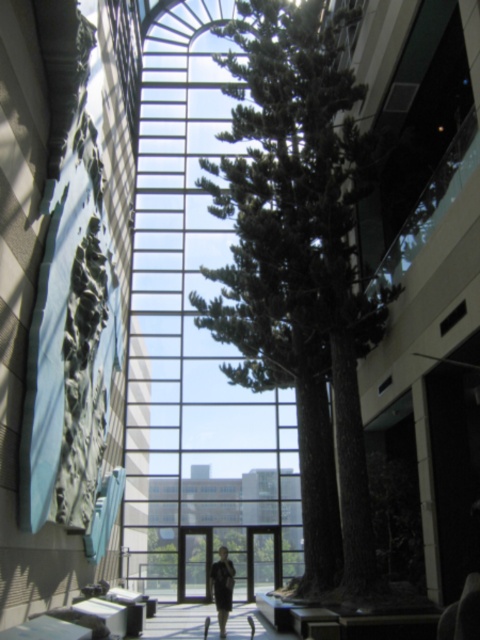
Question: Is green textured tree at center thinner than dark gray suit at center?

Choices:
 (A) yes
 (B) no

Answer: (B)

Question: Where is green textured tree at center located in relation to dark gray suit at center in the image?

Choices:
 (A) right
 (B) left

Answer: (A)

Question: Which of the following is the farthest from the observer?

Choices:
 (A) (220, 600)
 (B) (309, 451)

Answer: (B)

Question: Does green textured tree at center have a greater width compared to dark gray suit at center?

Choices:
 (A) no
 (B) yes

Answer: (B)